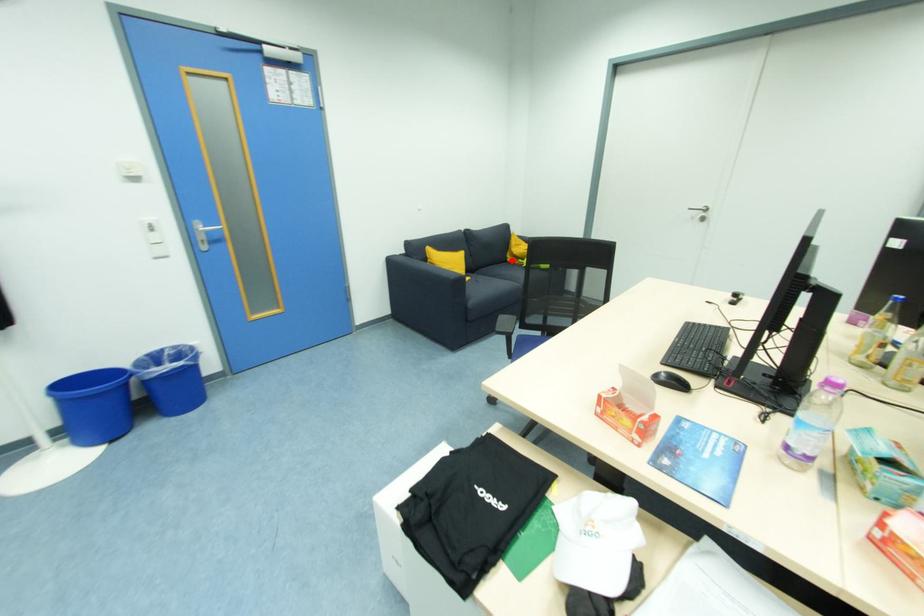
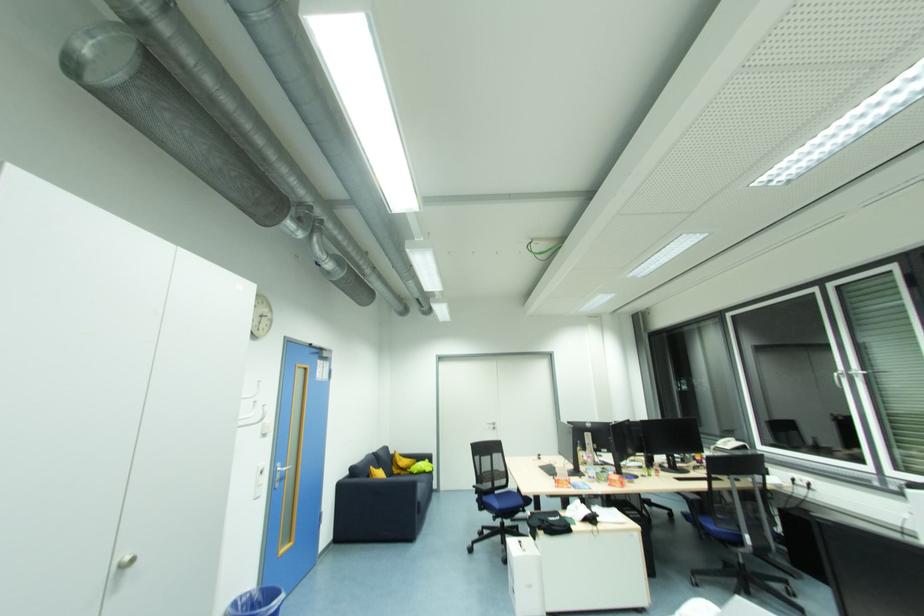
Question: A red point is marked in image1. In image2, is the corresponding 3D point closer to the camera or farther? Reply with the corresponding letter.

Choices:
 (A) The corresponding 3D point is closer.
 (B) The corresponding 3D point is farther.

Answer: (B)